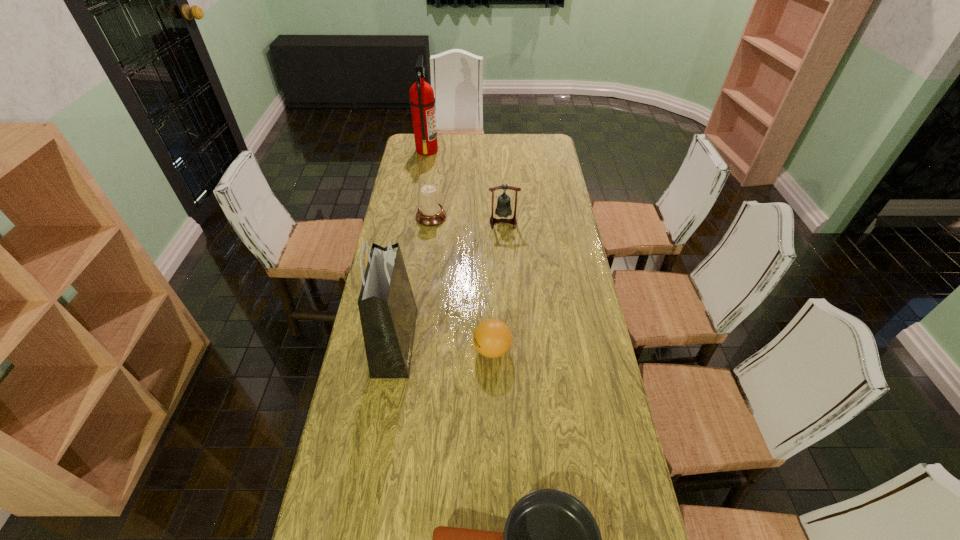
Where is `vacant area that lies between the candle holder and the ping-pong ball`? The image size is (960, 540). vacant area that lies between the candle holder and the ping-pong ball is located at coordinates (462, 284).

The height and width of the screenshot is (540, 960). Find the location of `empty space between the ping-pong ball and the bell`. empty space between the ping-pong ball and the bell is located at coordinates click(497, 286).

The image size is (960, 540). I want to click on empty space between the second shortest object and the shopping bag, so (x=444, y=346).

This screenshot has width=960, height=540. What are the coordinates of `free space between the shopping bag and the farthest object` in the screenshot? It's located at (411, 246).

Image resolution: width=960 pixels, height=540 pixels. I want to click on vacant area that lies between the shopping bag and the fourth tallest object, so click(413, 280).

Identify which object is the fourth nearest to the shopping bag. Please provide its 2D coordinates. Your answer should be formatted as a tuple, i.e. [(x, y)], where the tuple contains the x and y coordinates of a point satisfying the conditions above.

[(503, 209)]

Identify which object is the fifth closest to the ping-pong ball. Please provide its 2D coordinates. Your answer should be formatted as a tuple, i.e. [(x, y)], where the tuple contains the x and y coordinates of a point satisfying the conditions above.

[(422, 100)]

You are a GUI agent. You are given a task and a screenshot of the screen. Output one action in this format:
    pyautogui.click(x=<x>, y=<y>)
    Task: Click on the vacant point that satisfies the following two spatial constraints: 1. on the side of the fire extinguisher near the handle; 2. on the right side of the candle holder
    This screenshot has width=960, height=540.
    Given the screenshot: What is the action you would take?
    pyautogui.click(x=417, y=217)

Where is `free space in the image that satisfies the following two spatial constraints: 1. on the side of the farthest object near the handle; 2. on the right side of the candle holder`? The width and height of the screenshot is (960, 540). free space in the image that satisfies the following two spatial constraints: 1. on the side of the farthest object near the handle; 2. on the right side of the candle holder is located at coordinates (417, 217).

At what (x,y) coordinates should I click in order to perform the action: click on free space that satisfies the following two spatial constraints: 1. on the side of the bell near the handle; 2. on the left side of the farthest object. Please return your answer as a coordinate pair (x, y). The height and width of the screenshot is (540, 960). Looking at the image, I should click on (416, 222).